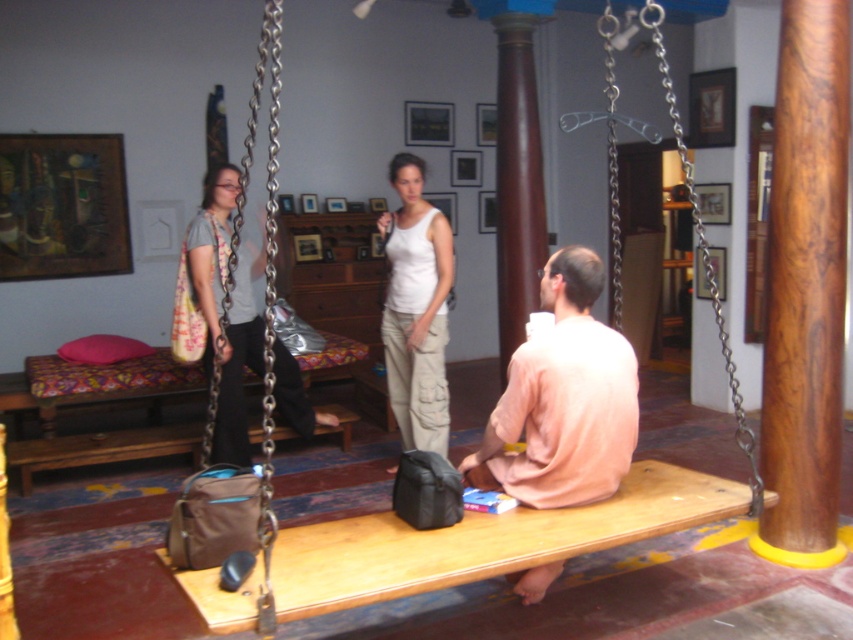
Does white cotton tank top at center have a lesser width compared to matte gray shirt at left?

Correct, white cotton tank top at center's width is less than matte gray shirt at left's.

Is white cotton tank top at center wider than matte gray shirt at left?

No, white cotton tank top at center is not wider than matte gray shirt at left.

Find the location of `white cotton tank top at center`. white cotton tank top at center is located at coordinates point(416,308).

Measure the distance between point (605, 353) and camera.

They are 8.03 feet apart.

Can you confirm if light pink cotton shirt at center is shorter than matte gray shirt at left?

Indeed, light pink cotton shirt at center has a lesser height compared to matte gray shirt at left.

At what (x,y) coordinates should I click in order to perform the action: click on light pink cotton shirt at center. Please return your answer as a coordinate pair (x, y). The width and height of the screenshot is (853, 640). Looking at the image, I should click on (563, 400).

Is wooden swing at center positioned at the back of light pink cotton shirt at center?

No, it is not.

Does wooden swing at center have a lesser height compared to light pink cotton shirt at center?

Yes.

Where is `wooden swing at center`? wooden swing at center is located at coordinates (450, 548).